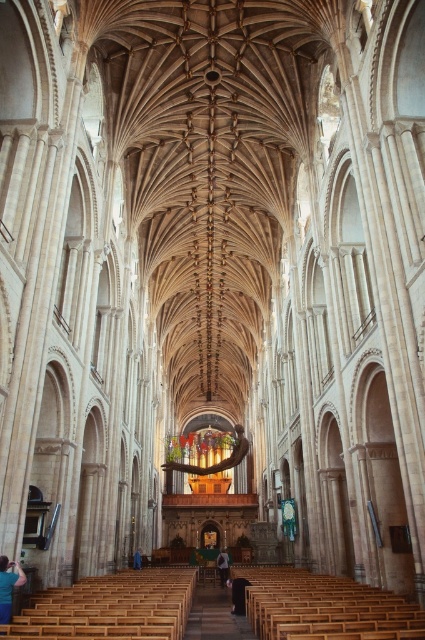
Question: Which object appears closest to the camera in this image?

Choices:
 (A) blue fabric at center
 (B) light blue fabric at center
 (C) blue fabric person at lower left

Answer: (C)

Question: Can you confirm if blue fabric person at lower left is wider than light blue fabric at center?

Choices:
 (A) no
 (B) yes

Answer: (A)

Question: Can you confirm if blue fabric person at lower left is positioned to the left of light blue fabric at center?

Choices:
 (A) no
 (B) yes

Answer: (B)

Question: Considering the real-world distances, which object is farthest from the blue fabric at center?

Choices:
 (A) blue fabric person at lower left
 (B) light blue fabric at center

Answer: (A)

Question: Among these objects, which one is farthest from the camera?

Choices:
 (A) blue fabric at center
 (B) blue fabric person at lower left

Answer: (A)

Question: Is blue fabric person at lower left thinner than light blue fabric at center?

Choices:
 (A) no
 (B) yes

Answer: (B)